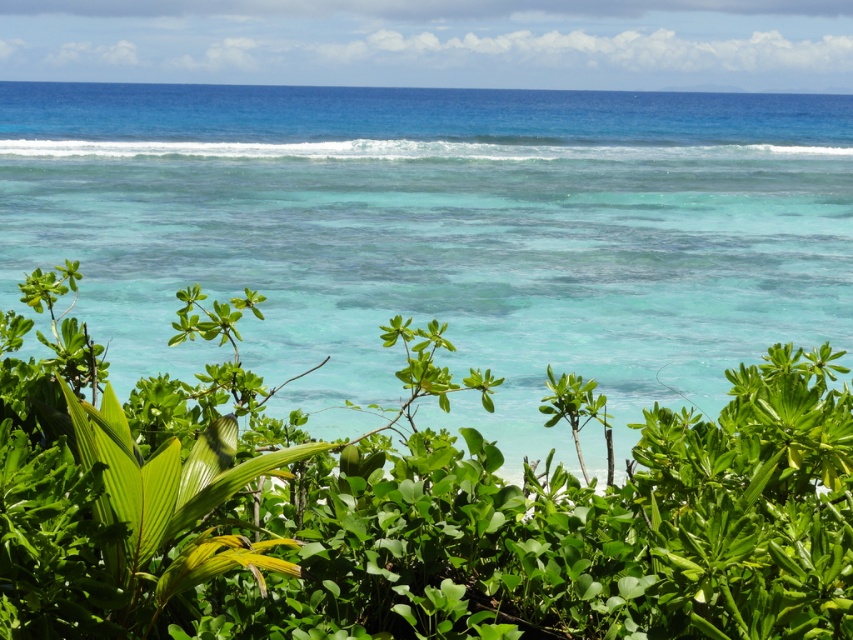
You are standing at the edge of the ocean in the coastal scene. There is a point marked at coordinates point (440,234). What does this point represent?

The point (440,234) represents the location of the turquoise clear water at center.

You are standing on the beach and want to place a 3.5 meter long wooden board between the turquoise clear water at center and the dense green shrubs. Will the board fit perfectly between them?

The distance between the turquoise clear water at center and the dense green shrubs is 3.53 meters, so the 3.5 meter long wooden board will fit perfectly between them with a small amount of space remaining.